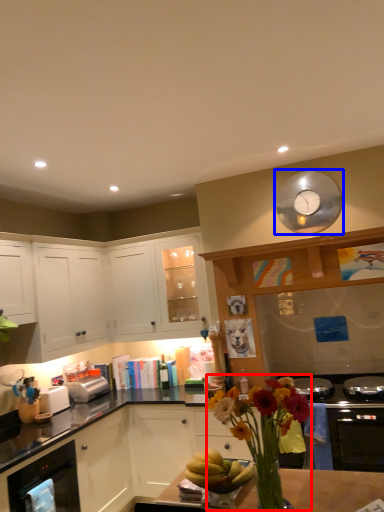
Question: Which object appears closest to the camera in this image, floral arrangement (highlighted by a red box) or clock (highlighted by a blue box)?

Choices:
 (A) floral arrangement
 (B) clock

Answer: (A)